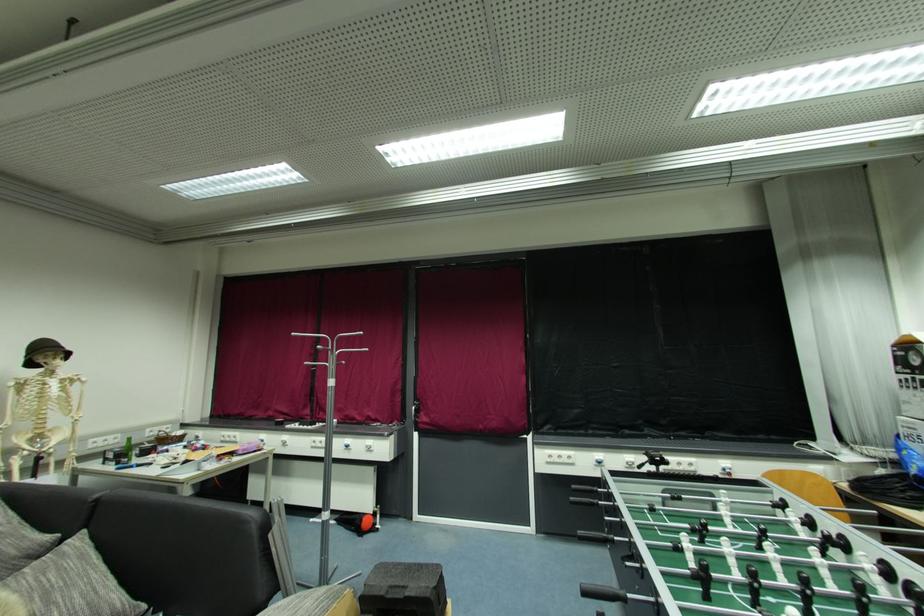
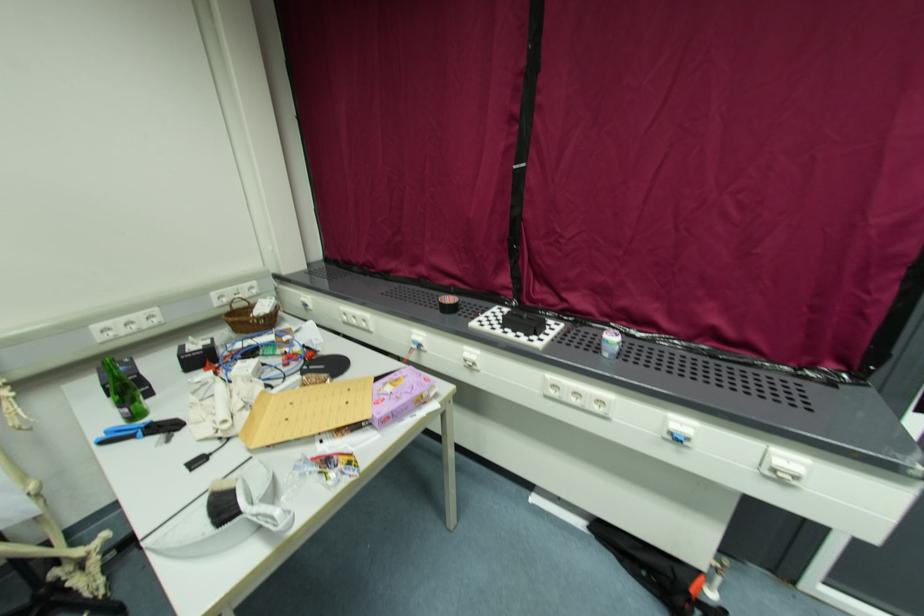
The point at (122, 469) is marked in the first image. Where is the corresponding point in the second image?

(107, 443)